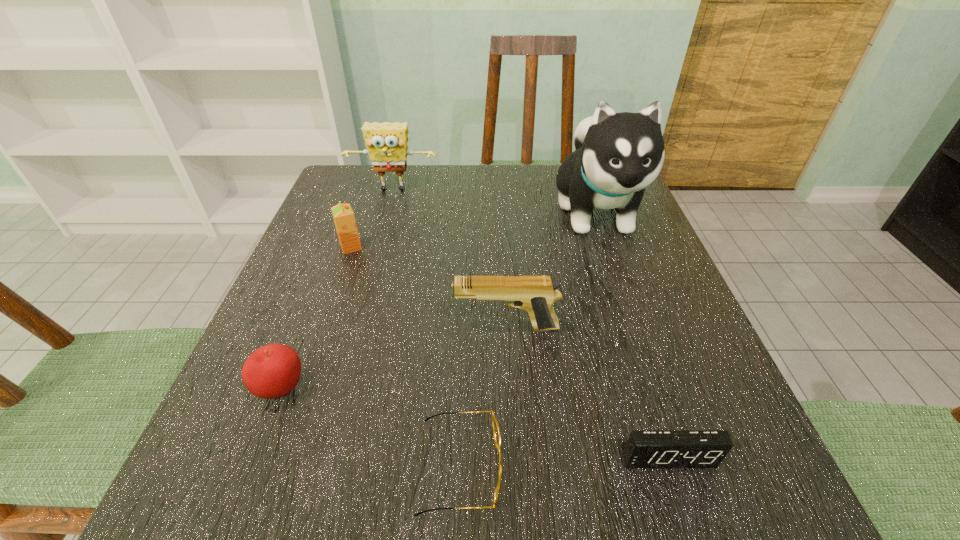
The width and height of the screenshot is (960, 540). Find the location of `free space between the tallest object and the orange juice`. free space between the tallest object and the orange juice is located at coordinates (473, 229).

You are a GUI agent. You are given a task and a screenshot of the screen. Output one action in this format:
    pyautogui.click(x=<x>, y=<y>)
    Task: Click on the unoccupied position between the tallest object and the fifth farthest object
    The height and width of the screenshot is (540, 960).
    Given the screenshot: What is the action you would take?
    pyautogui.click(x=439, y=300)

You are a GUI agent. You are given a task and a screenshot of the screen. Output one action in this format:
    pyautogui.click(x=<x>, y=<y>)
    Task: Click on the free space between the pistol and the sponge
    
    Given the screenshot: What is the action you would take?
    pyautogui.click(x=449, y=259)

Where is `vacant space that is in between the tallest object and the orange juice`? This screenshot has height=540, width=960. vacant space that is in between the tallest object and the orange juice is located at coordinates (473, 229).

Identify which object is located as the sixth nearest to the fifth tallest object. Please provide its 2D coordinates. Your answer should be formatted as a tuple, i.e. [(x, y)], where the tuple contains the x and y coordinates of a point satisfying the conditions above.

[(617, 155)]

Find the location of a particular element. The width and height of the screenshot is (960, 540). the second closest object to the fifth farthest object is located at coordinates (535, 294).